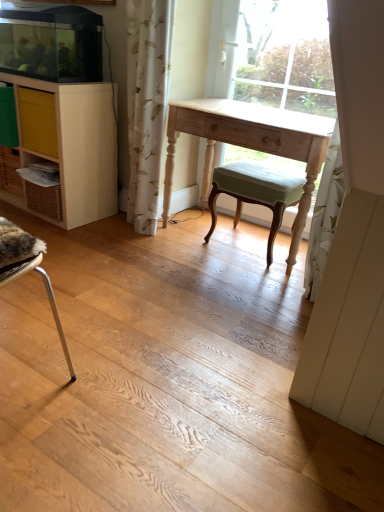
The width and height of the screenshot is (384, 512). Identify the location of free space in front of white floral fabric curtain at center. (131, 241).